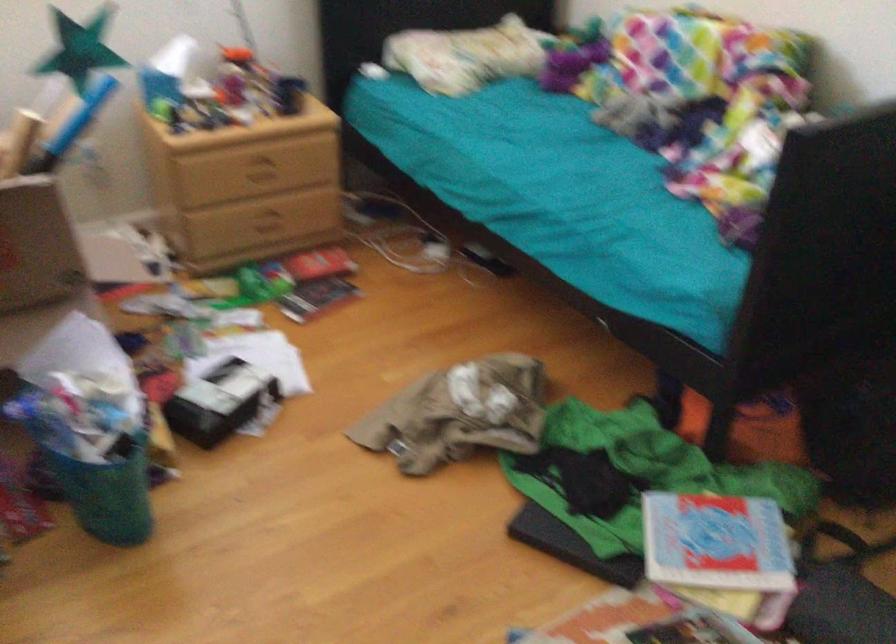
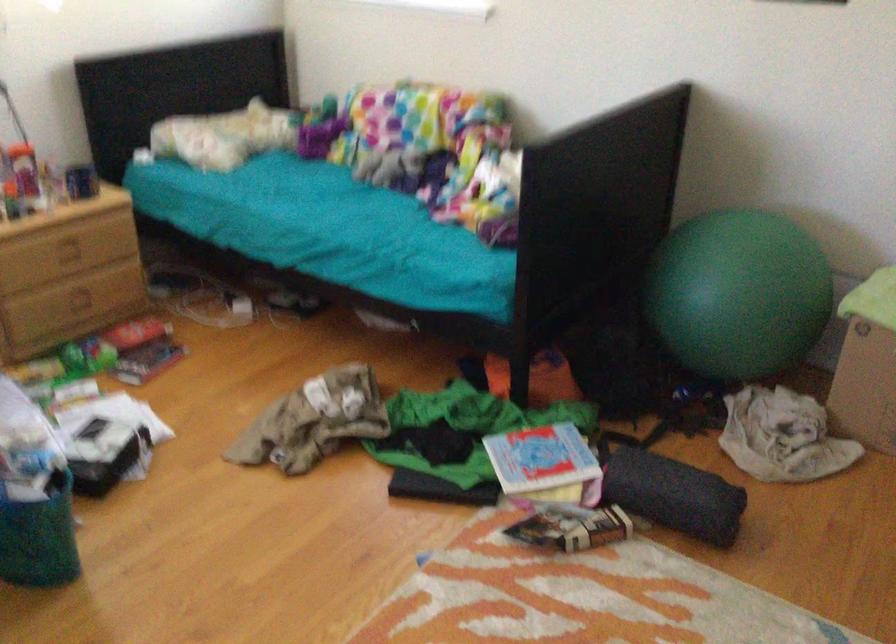
Question: The first image is from the beginning of the video and the second image is from the end. How did the camera likely rotate when shooting the video?

Choices:
 (A) Left
 (B) Right
 (C) Up
 (D) Down

Answer: (B)